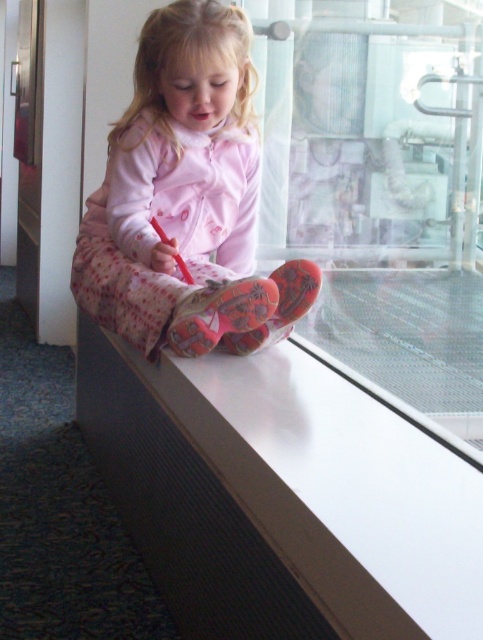
Does white smooth ledge at center have a greater height compared to pink fleece pajamas at center?

No.

What do you see at coordinates (282, 497) in the screenshot? This screenshot has width=483, height=640. I see `white smooth ledge at center` at bounding box center [282, 497].

The image size is (483, 640). In order to click on white smooth ledge at center in this screenshot , I will do `click(282, 497)`.

Who is more distant from viewer, (383,422) or (316,176)?

The point (316,176) is behind.

Is white smooth ledge at center above transparent glass window at center?

Actually, white smooth ledge at center is below transparent glass window at center.

Does point (249, 472) lie behind point (428, 65)?

No.

At what (x,y) coordinates should I click in order to perform the action: click on white smooth ledge at center. Please return your answer as a coordinate pair (x, y). The image size is (483, 640). Looking at the image, I should click on (282, 497).

Which is more to the right, transparent glass window at center or pink fleece pajamas at center?

transparent glass window at center is more to the right.

Does transparent glass window at center appear on the right side of pink fleece pajamas at center?

Yes, transparent glass window at center is to the right of pink fleece pajamas at center.

Identify the location of transparent glass window at center. The width and height of the screenshot is (483, 640). (381, 193).

Image resolution: width=483 pixels, height=640 pixels. What are the coordinates of `transparent glass window at center` in the screenshot? It's located at (381, 193).